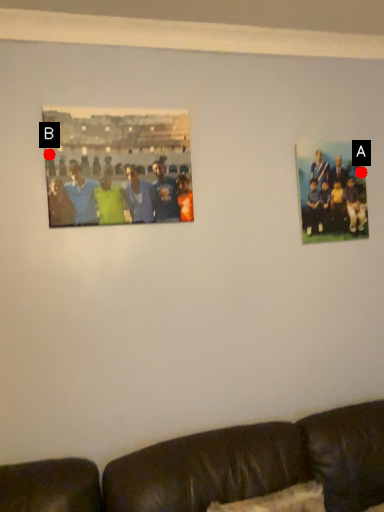
Question: Two points are circled on the image, labeled by A and B beside each circle. Among these points, which one is nearest to the camera?

Choices:
 (A) A is closer
 (B) B is closer

Answer: (B)